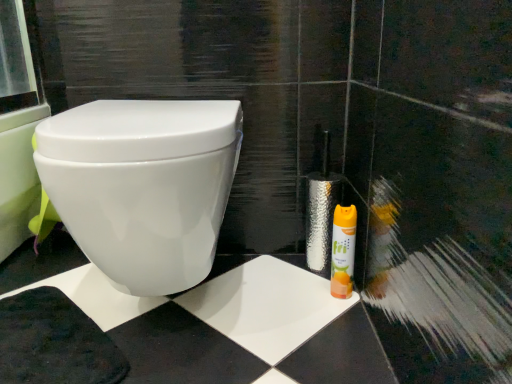
Question: Is white glossy toilet at center situated inside yellow matte canister at lower right or outside?

Choices:
 (A) outside
 (B) inside

Answer: (A)

Question: In terms of size, does white glossy toilet at center appear bigger or smaller than yellow matte canister at lower right?

Choices:
 (A) big
 (B) small

Answer: (A)

Question: Is point (148, 102) closer or farther from the camera than point (355, 226)?

Choices:
 (A) closer
 (B) farther

Answer: (A)

Question: Considering their positions, is yellow matte canister at lower right located in front of or behind white glossy toilet at center?

Choices:
 (A) behind
 (B) front

Answer: (A)

Question: From a real-world perspective, is yellow matte canister at lower right positioned above or below white glossy toilet at center?

Choices:
 (A) below
 (B) above

Answer: (A)

Question: In terms of size, does yellow matte canister at lower right appear bigger or smaller than white glossy toilet at center?

Choices:
 (A) big
 (B) small

Answer: (B)

Question: Looking at their shapes, would you say yellow matte canister at lower right is wider or thinner than white glossy toilet at center?

Choices:
 (A) thin
 (B) wide

Answer: (A)